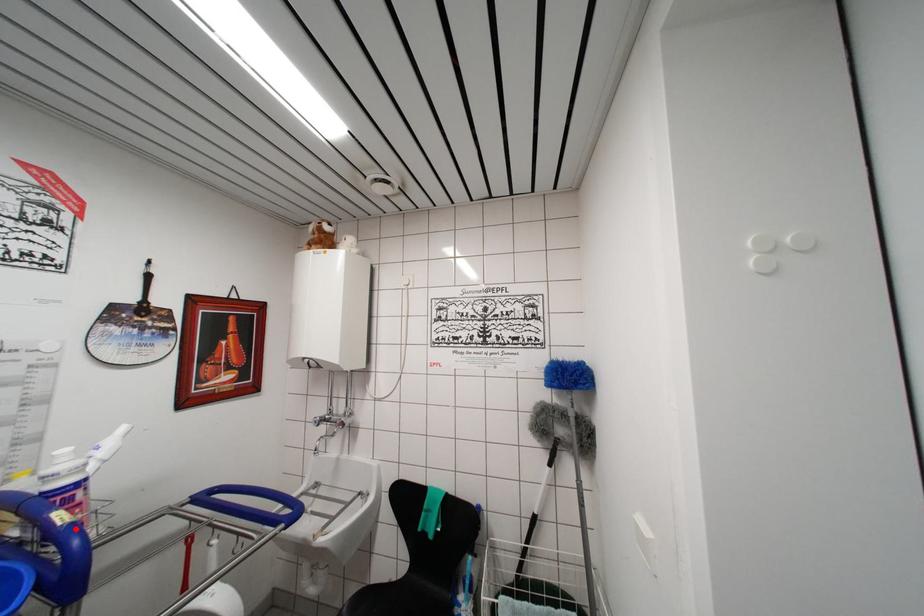
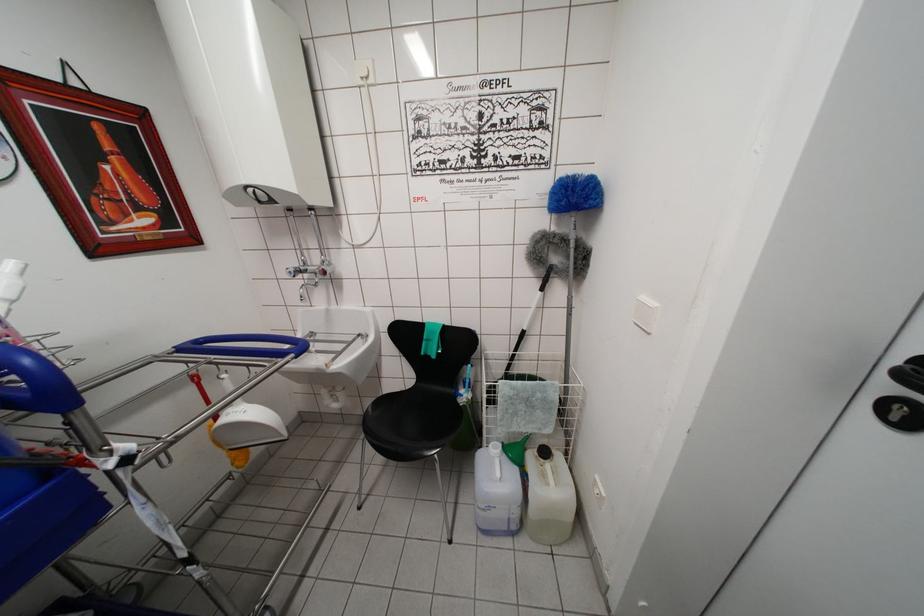
Where in the second image is the point corresponding to the highlighted location from the first image?

(5, 349)